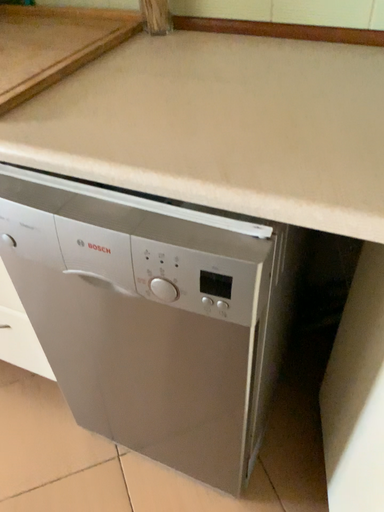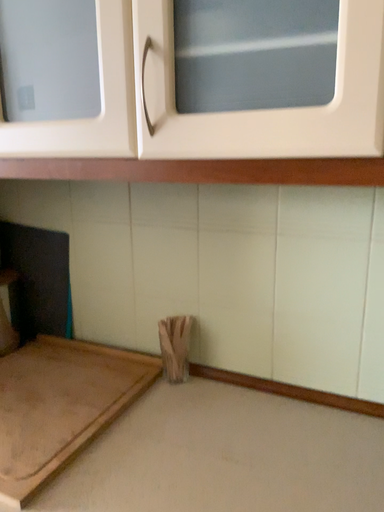
Question: Which way did the camera rotate in the video?

Choices:
 (A) rotated downward
 (B) rotated upward

Answer: (B)